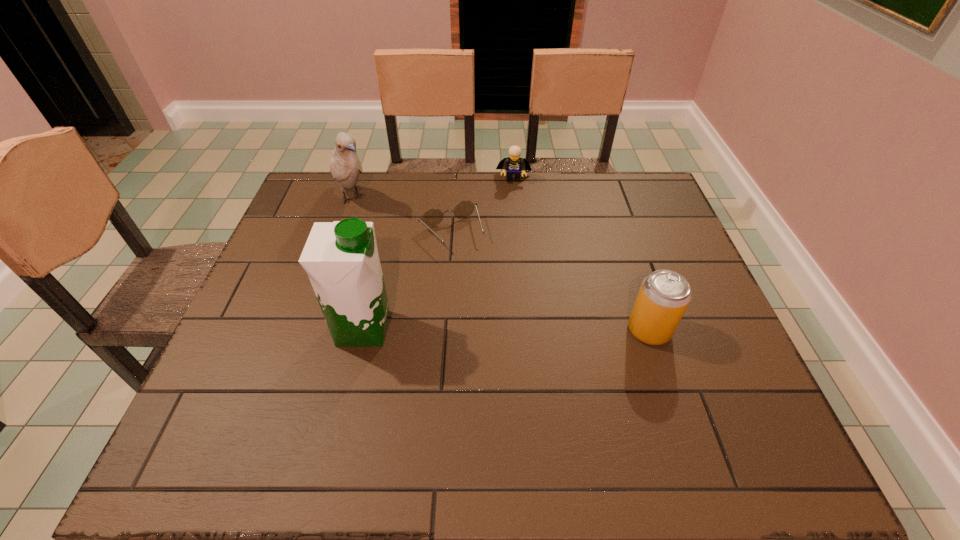
Identify the location of free spot on the desktop that is between the tallest object and the rightmost object and is positioned on the front-facing side of the spectacles. This screenshot has width=960, height=540. (509, 329).

Identify the location of vacant space on the desktop that is between the tallest object and the rightmost object and is positioned at the beak of the bird. The height and width of the screenshot is (540, 960). coord(480,329).

Where is `vacant space on the desktop that is between the tallest object and the pop (soda) and is positioned on the front-facing side of the fourth tallest object`? vacant space on the desktop that is between the tallest object and the pop (soda) and is positioned on the front-facing side of the fourth tallest object is located at coordinates (509, 329).